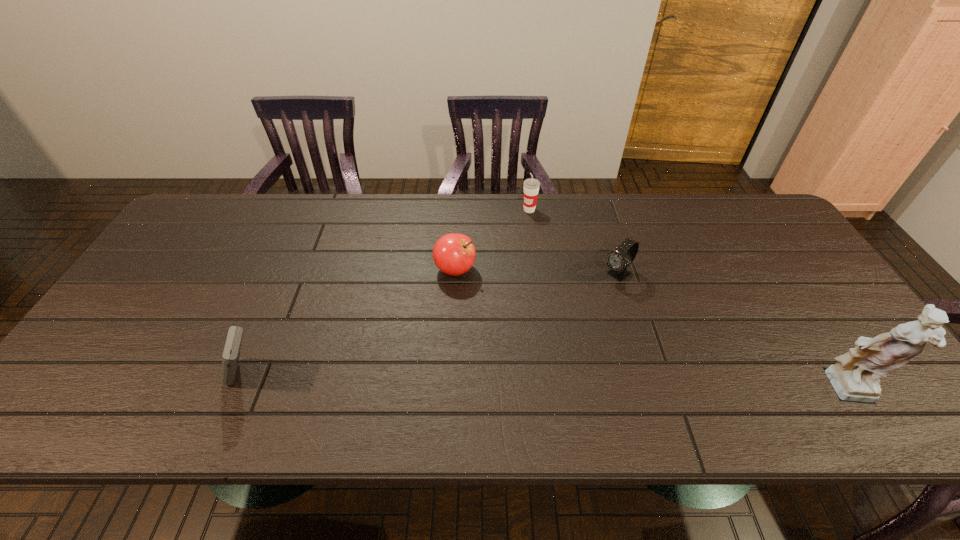
I want to click on calculator that is at the near edge, so click(x=231, y=353).

Locate an element on the screen. This screenshot has width=960, height=540. figurine that is at the near edge is located at coordinates (855, 377).

At what (x,y) coordinates should I click in order to perform the action: click on object located in the right edge section of the desktop. Please return your answer as a coordinate pair (x, y). Looking at the image, I should click on (855, 377).

This screenshot has width=960, height=540. Identify the location of object situated at the near right corner. (855, 377).

In the image, there is a desktop. Identify the location of vacant space at the far edge. (256, 194).

Locate an element on the screen. This screenshot has width=960, height=540. free space at the near edge of the desktop is located at coordinates (164, 372).

The height and width of the screenshot is (540, 960). I want to click on vacant space at the left edge of the desktop, so click(145, 341).

In the image, there is a desktop. Identify the location of vacant space at the far left corner. This screenshot has width=960, height=540. (204, 231).

The image size is (960, 540). Find the location of `free location at the far right corner`. free location at the far right corner is located at coordinates (738, 201).

At what (x,y) coordinates should I click in order to perform the action: click on free space between the tallest object and the third object from right to left. Please return your answer as a coordinate pair (x, y). The width and height of the screenshot is (960, 540). Looking at the image, I should click on (687, 301).